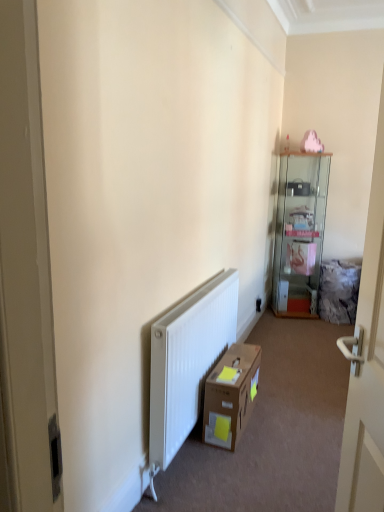
Question: Is black plastic electric outlet at center facing towards brown cardboard box at lower center?

Choices:
 (A) yes
 (B) no

Answer: (B)

Question: From a real-world perspective, is black plastic electric outlet at center over brown cardboard box at lower center?

Choices:
 (A) no
 (B) yes

Answer: (A)

Question: From a real-world perspective, is black plastic electric outlet at center located beneath brown cardboard box at lower center?

Choices:
 (A) yes
 (B) no

Answer: (A)

Question: Is black plastic electric outlet at center next to brown cardboard box at lower center?

Choices:
 (A) yes
 (B) no

Answer: (B)

Question: Is black plastic electric outlet at center shorter than brown cardboard box at lower center?

Choices:
 (A) yes
 (B) no

Answer: (A)

Question: Looking at their shapes, would you say white glossy door at right is wider or thinner than black plastic electric outlet at center?

Choices:
 (A) wide
 (B) thin

Answer: (A)

Question: Is point (362, 492) positioned closer to the camera than point (258, 311)?

Choices:
 (A) closer
 (B) farther

Answer: (A)

Question: Would you say white glossy door at right is to the left or to the right of black plastic electric outlet at center in the picture?

Choices:
 (A) right
 (B) left

Answer: (B)

Question: From a real-world perspective, is white glossy door at right above or below black plastic electric outlet at center?

Choices:
 (A) below
 (B) above

Answer: (B)

Question: In terms of size, does clear glass cabinet at upper right appear bigger or smaller than brown cardboard box at lower center?

Choices:
 (A) small
 (B) big

Answer: (B)

Question: Is clear glass cabinet at upper right wider or thinner than brown cardboard box at lower center?

Choices:
 (A) wide
 (B) thin

Answer: (A)

Question: Does point (312, 224) appear closer or farther from the camera than point (244, 403)?

Choices:
 (A) closer
 (B) farther

Answer: (B)

Question: Considering their positions, is clear glass cabinet at upper right located in front of or behind brown cardboard box at lower center?

Choices:
 (A) behind
 (B) front

Answer: (A)

Question: From a real-world perspective, is brown cardboard box at lower center physically located above or below white glossy door at right?

Choices:
 (A) above
 (B) below

Answer: (B)

Question: In terms of width, does brown cardboard box at lower center look wider or thinner when compared to white glossy door at right?

Choices:
 (A) wide
 (B) thin

Answer: (A)